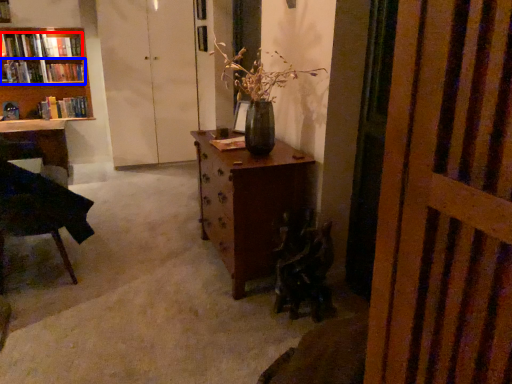
Question: Which point is further to the camera, book (highlighted by a red box) or book (highlighted by a blue box)?

Choices:
 (A) book
 (B) book

Answer: (B)